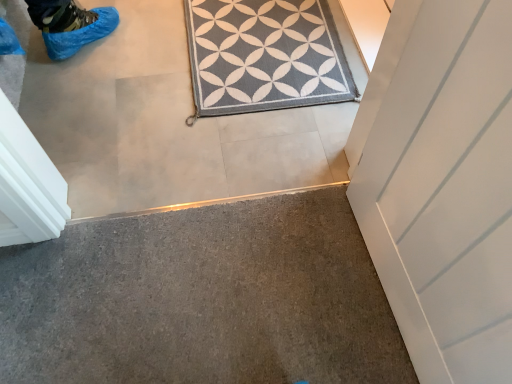
Question: Does point (369, 372) appear closer or farther from the camera than point (317, 11)?

Choices:
 (A) closer
 (B) farther

Answer: (A)

Question: Visually, is gray carpet at lower left positioned to the left or to the right of gray textured rug at center?

Choices:
 (A) right
 (B) left

Answer: (B)

Question: Considering the positions of gray carpet at lower left and gray textured rug at center in the image, is gray carpet at lower left wider or thinner than gray textured rug at center?

Choices:
 (A) thin
 (B) wide

Answer: (B)

Question: From the image's perspective, is gray textured rug at center positioned above or below gray carpet at lower left?

Choices:
 (A) above
 (B) below

Answer: (A)

Question: Does point (271, 97) appear closer or farther from the camera than point (66, 276)?

Choices:
 (A) closer
 (B) farther

Answer: (B)

Question: Is gray textured rug at center to the left or to the right of gray carpet at lower left in the image?

Choices:
 (A) left
 (B) right

Answer: (B)

Question: Considering their positions, is gray textured rug at center located in front of or behind gray carpet at lower left?

Choices:
 (A) front
 (B) behind

Answer: (B)